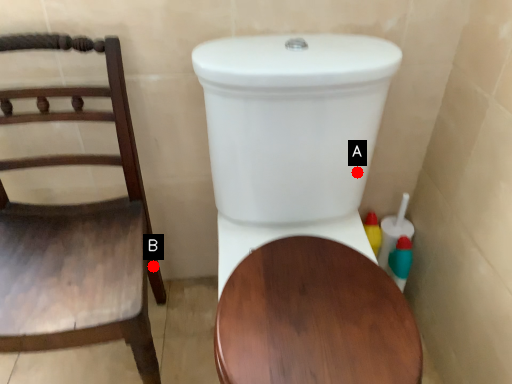
Question: Two points are circled on the image, labeled by A and B beside each circle. Which of the following is the closest to the observer?

Choices:
 (A) A is closer
 (B) B is closer

Answer: (A)